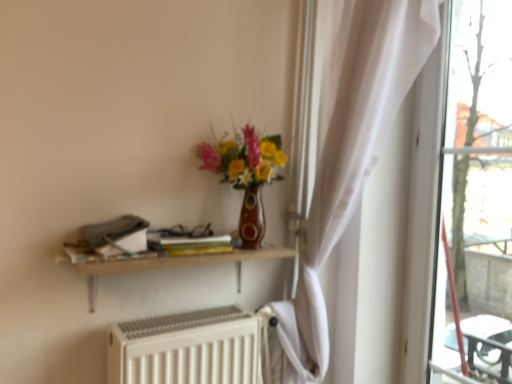
Question: Does wooden shelf at upper center have a lesser width compared to white matte radiator at lower center?

Choices:
 (A) yes
 (B) no

Answer: (A)

Question: Does wooden shelf at upper center have a larger size compared to white matte radiator at lower center?

Choices:
 (A) yes
 (B) no

Answer: (B)

Question: Considering the relative positions of wooden shelf at upper center and white matte radiator at lower center in the image provided, is wooden shelf at upper center behind white matte radiator at lower center?

Choices:
 (A) yes
 (B) no

Answer: (B)

Question: Can you confirm if wooden shelf at upper center is wider than white matte radiator at lower center?

Choices:
 (A) no
 (B) yes

Answer: (A)

Question: Is white matte radiator at lower center located within wooden shelf at upper center?

Choices:
 (A) no
 (B) yes

Answer: (A)

Question: Choose the correct answer: Is white matte radiator at lower center inside matte ceramic vase at center or outside it?

Choices:
 (A) outside
 (B) inside

Answer: (A)

Question: In terms of width, does white matte radiator at lower center look wider or thinner when compared to matte ceramic vase at center?

Choices:
 (A) wide
 (B) thin

Answer: (B)

Question: Considering the positions of point pyautogui.click(x=125, y=360) and point pyautogui.click(x=279, y=142), is point pyautogui.click(x=125, y=360) closer or farther from the camera than point pyautogui.click(x=279, y=142)?

Choices:
 (A) farther
 (B) closer

Answer: (B)

Question: Would you say white matte radiator at lower center is to the left or to the right of matte ceramic vase at center in the picture?

Choices:
 (A) left
 (B) right

Answer: (A)

Question: Considering the positions of point (170, 235) and point (250, 127), is point (170, 235) closer or farther from the camera than point (250, 127)?

Choices:
 (A) farther
 (B) closer

Answer: (B)

Question: From a real-world perspective, is yellow matte book at center above or below matte ceramic vase at center?

Choices:
 (A) above
 (B) below

Answer: (B)

Question: Considering their positions, is yellow matte book at center located in front of or behind matte ceramic vase at center?

Choices:
 (A) front
 (B) behind

Answer: (B)

Question: Looking at the image, does yellow matte book at center seem bigger or smaller compared to matte ceramic vase at center?

Choices:
 (A) small
 (B) big

Answer: (A)

Question: In the image, is white matte radiator at lower center positioned in front of or behind yellow matte book at center?

Choices:
 (A) front
 (B) behind

Answer: (A)

Question: Visually, is white matte radiator at lower center positioned to the left or to the right of yellow matte book at center?

Choices:
 (A) right
 (B) left

Answer: (A)